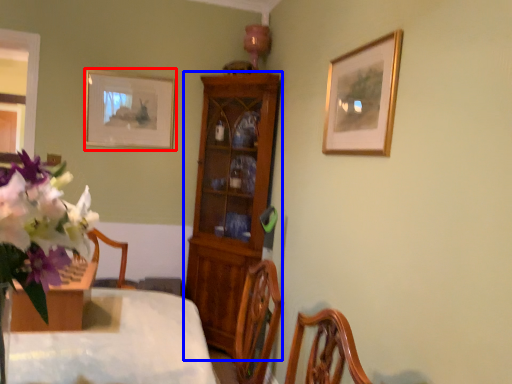
Question: Which object is further to the camera taking this photo, picture frame (highlighted by a red box) or cabinetry (highlighted by a blue box)?

Choices:
 (A) picture frame
 (B) cabinetry

Answer: (A)